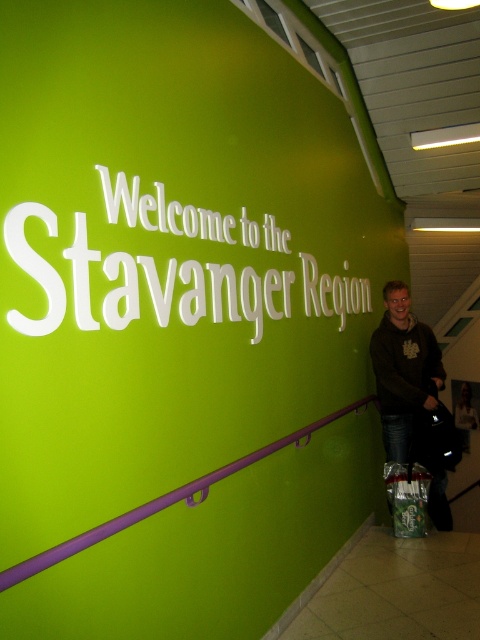
Identify the location of white matte sign at upper center. (171, 289).

Which of these two, white matte sign at upper center or smooth white shirt at center, stands taller?

Standing taller between the two is smooth white shirt at center.

Identify the location of white matte sign at upper center. The width and height of the screenshot is (480, 640). (171, 289).

Looking at this image, does white matte sign at upper center appear over dark brown sweater at lower right?

Indeed, white matte sign at upper center is positioned over dark brown sweater at lower right.

Is white matte sign at upper center below dark brown sweater at lower right?

No, white matte sign at upper center is not below dark brown sweater at lower right.

Between point (242, 296) and point (408, 448), which one is positioned behind?

Point (408, 448)

The width and height of the screenshot is (480, 640). Find the location of `white matte sign at upper center`. white matte sign at upper center is located at coordinates (171, 289).

Who is shorter, dark brown sweater at lower right or smooth white shirt at center?

Standing shorter between the two is smooth white shirt at center.

Is dark brown sweater at lower right taller than smooth white shirt at center?

Yes, dark brown sweater at lower right is taller than smooth white shirt at center.

This screenshot has height=640, width=480. Find the location of `dark brown sweater at lower right`. dark brown sweater at lower right is located at coordinates (404, 371).